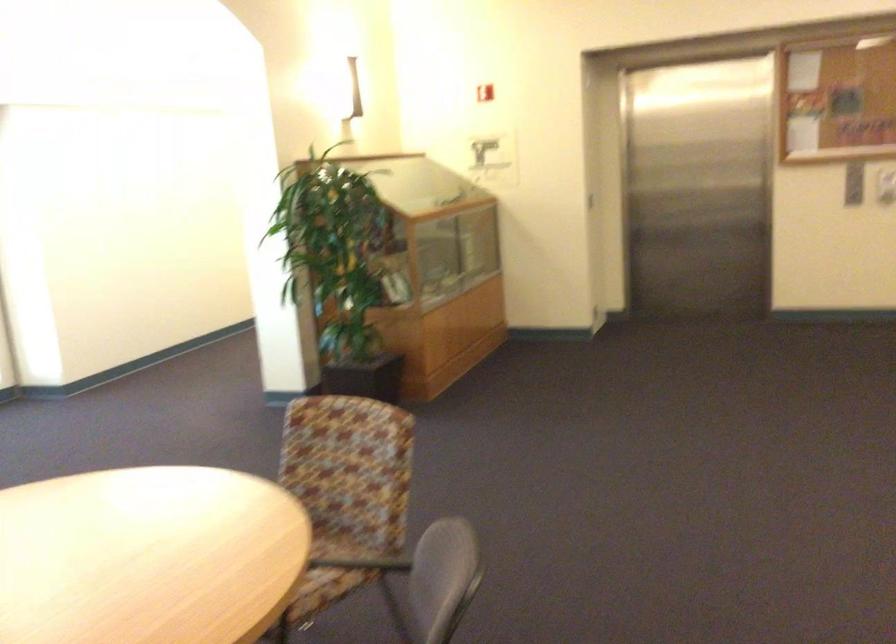
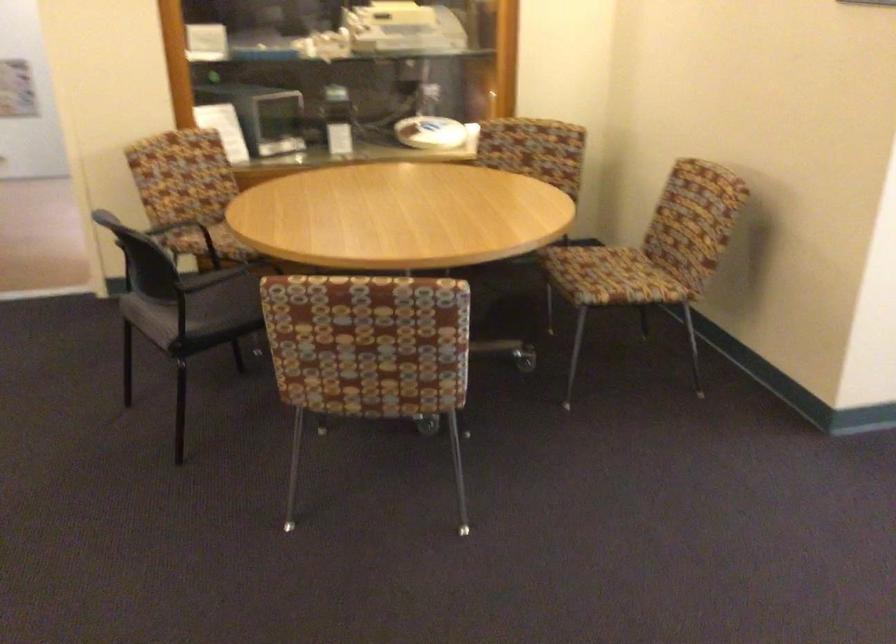
Locate, in the second image, the point that corresponds to pixel 354 477 in the first image.

(368, 353)